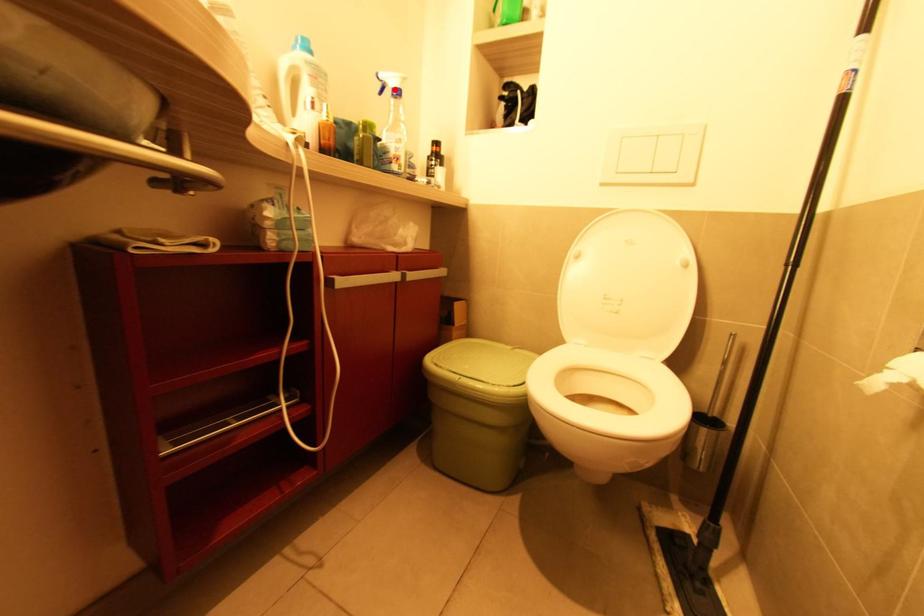
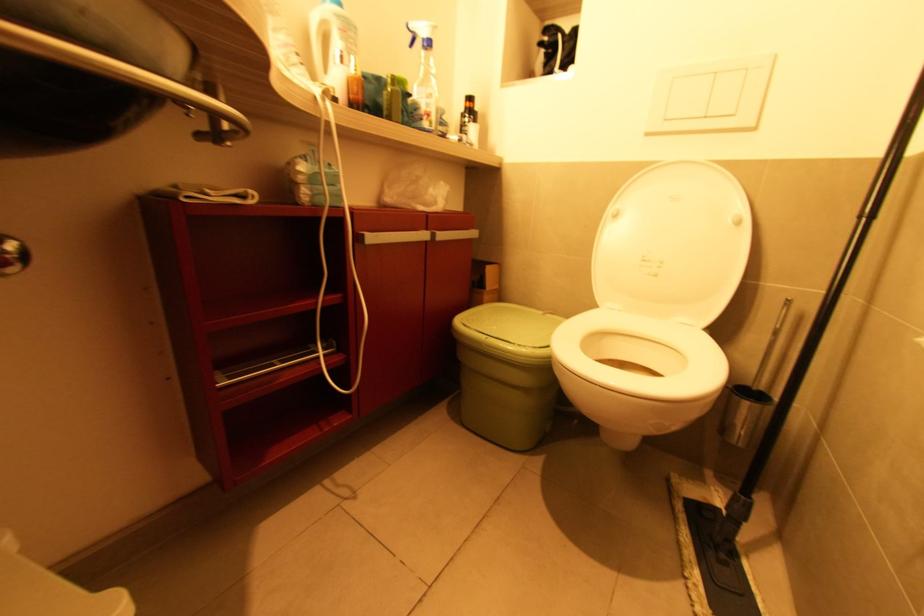
The point at the highlighted location is marked in the first image. Where is the corresponding point in the second image?

(427, 42)